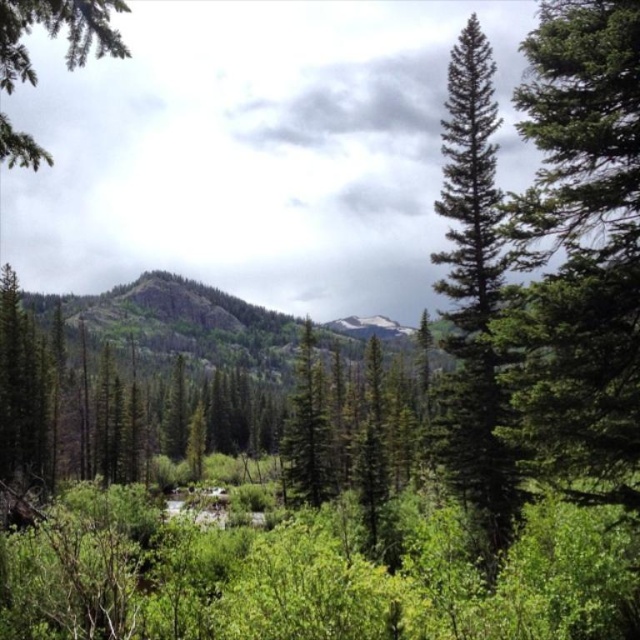
Is the position of green textured rock at center more distant than that of green matte tree at center?

Yes, it is.

Does green textured rock at center appear under green matte tree at center?

No.

Is point (157, 321) behind point (310, 483)?

Yes, it is.

Find the location of a particular element. This screenshot has width=640, height=640. green textured rock at center is located at coordinates (182, 321).

Between point (472, 372) and point (164, 272), which one is positioned in front?

Point (472, 372)

Is green needle-like tree at center-right to the left of green textured rock at center from the viewer's perspective?

No, green needle-like tree at center-right is not to the left of green textured rock at center.

Locate an element on the screen. green needle-like tree at center-right is located at coordinates (474, 292).

Which of these two, green needle-like tree at center-right or green matte tree at center, stands shorter?

green matte tree at center is shorter.

Is green needle-like tree at center-right closer to the viewer compared to green matte tree at center?

Yes, green needle-like tree at center-right is closer to the viewer.

Where is `green needle-like tree at center-right`? The height and width of the screenshot is (640, 640). green needle-like tree at center-right is located at coordinates (474, 292).

Locate an element on the screen. This screenshot has width=640, height=640. green needle-like tree at center-right is located at coordinates (474, 292).